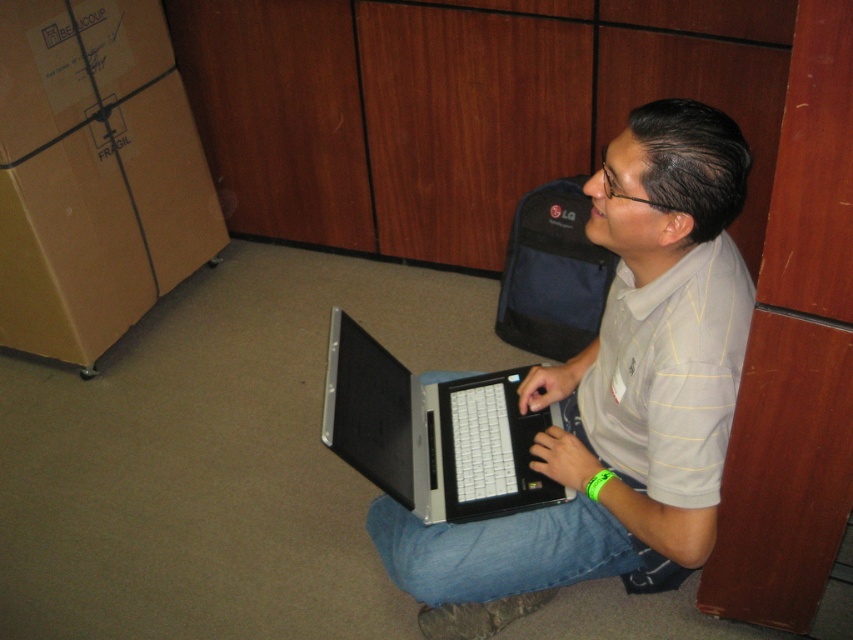
Question: Which point is farther from the camera taking this photo?

Choices:
 (A) (672, 540)
 (B) (556, 410)

Answer: (B)

Question: Does gray matte laptop at center appear on the right side of silver metallic laptop at center?

Choices:
 (A) yes
 (B) no

Answer: (A)

Question: Does gray matte laptop at center appear on the right side of silver metallic laptop at center?

Choices:
 (A) no
 (B) yes

Answer: (B)

Question: Which point is closer to the camera taking this photo?

Choices:
 (A) (514, 520)
 (B) (461, 456)

Answer: (A)

Question: Is gray matte laptop at center below silver metallic laptop at center?

Choices:
 (A) yes
 (B) no

Answer: (B)